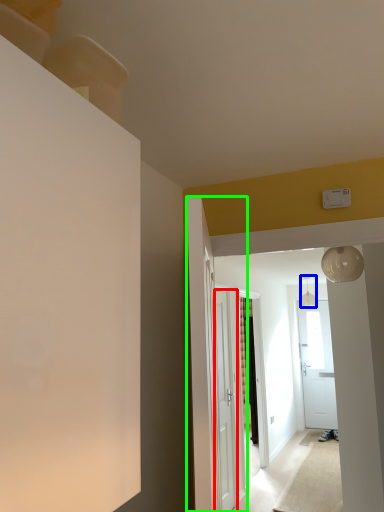
Question: Which object is the farthest from door (highlighted by a red box)? Choose among these: light fixture (highlighted by a blue box) or door (highlighted by a green box).

Choices:
 (A) light fixture
 (B) door

Answer: (A)